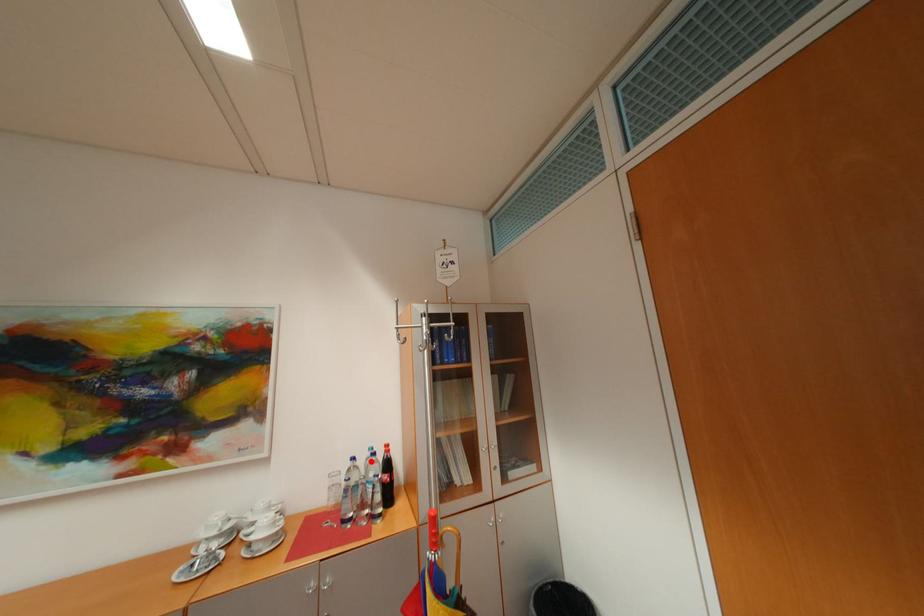
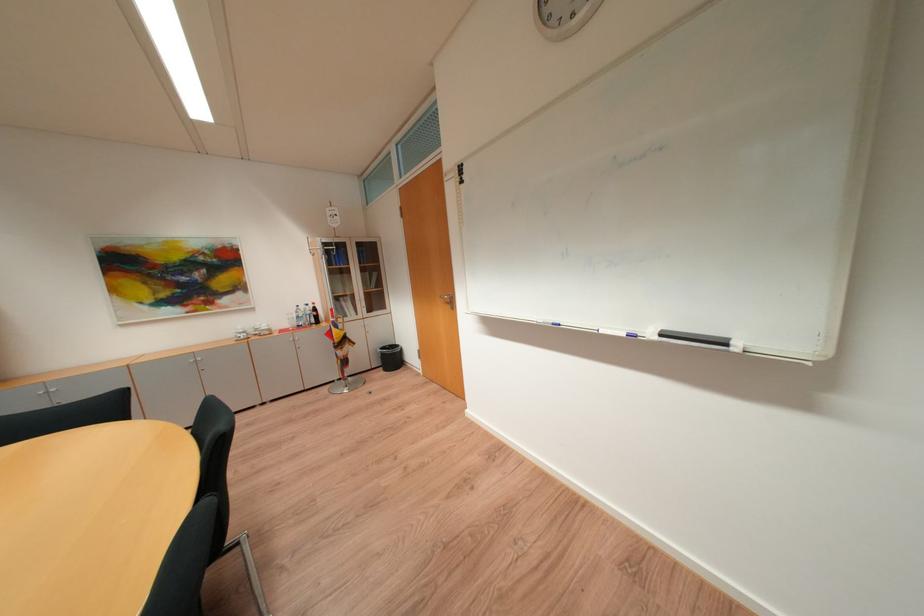
Question: I am providing you with two images of the same scene from different viewpoints. Image1 has a red point marked. In image2, the corresponding 3D location appears at what relative position? Reply with the corresponding letter.

Choices:
 (A) Closer
 (B) Farther

Answer: (A)